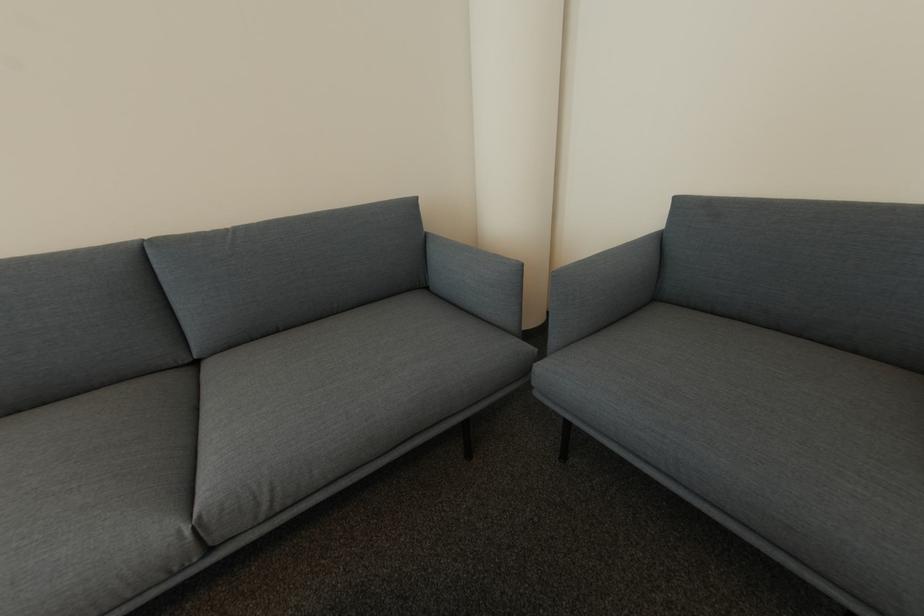
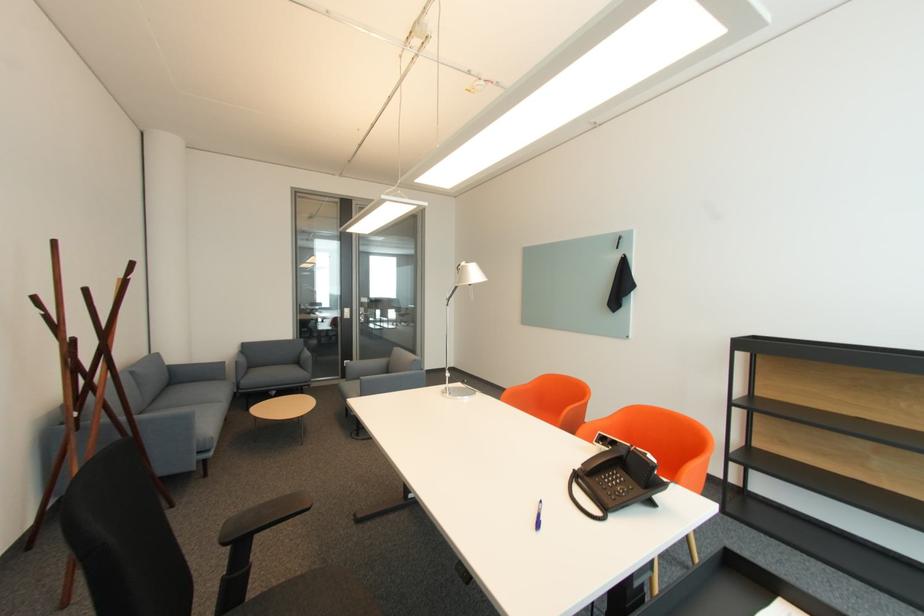
The point at (203, 363) is marked in the first image. Where is the corresponding point in the second image?

(151, 411)